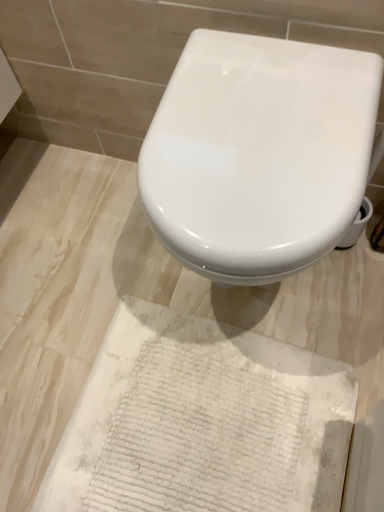
At what (x,y) coordinates should I click in order to perform the action: click on vacant region below white textured rug at lower center (from a real-world perspective). Please return your answer as a coordinate pair (x, y). This screenshot has width=384, height=512. Looking at the image, I should click on pyautogui.click(x=199, y=426).